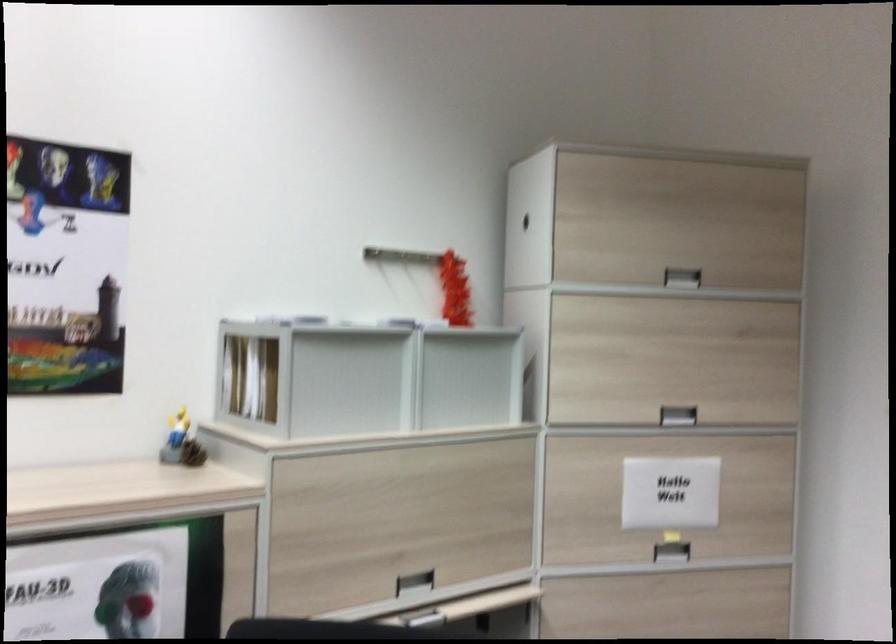
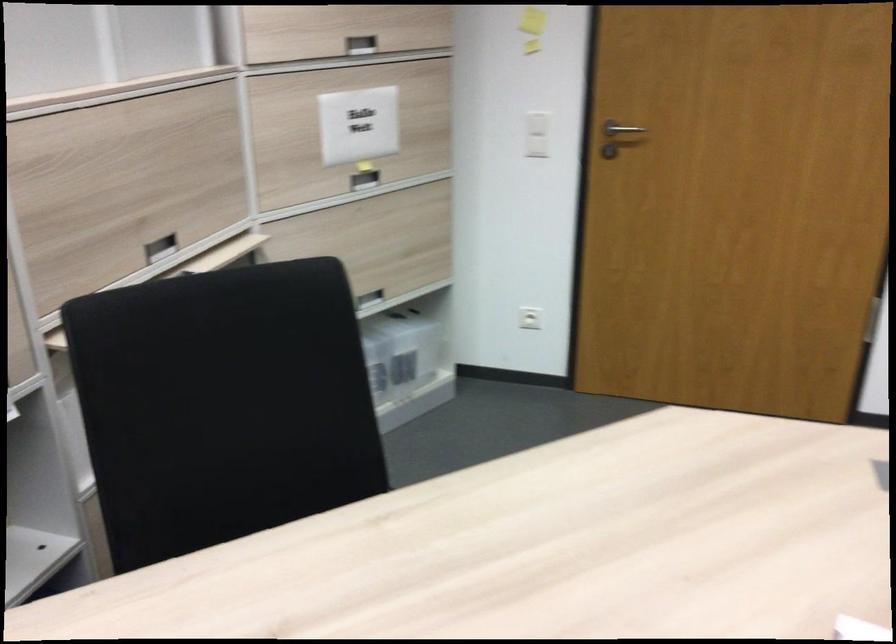
Locate, in the second image, the point that corresponds to pixel 670 491 in the first image.

(358, 125)